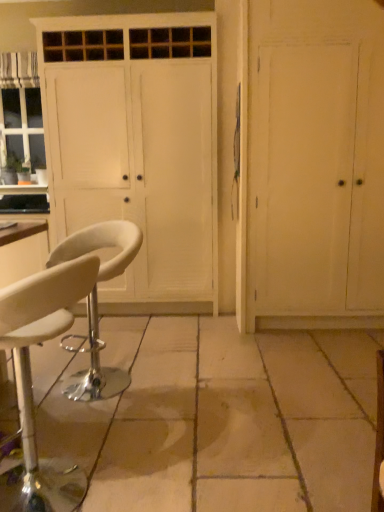
The image size is (384, 512). In order to click on free space that is in between white leather stool at lower left, the second chair from the front, and white wood door at right in this screenshot , I will do `click(208, 353)`.